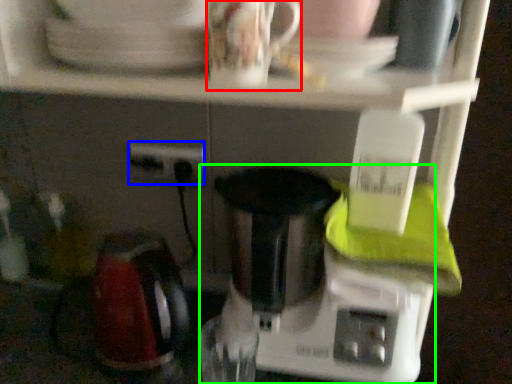
Question: Based on their relative distances, which object is farther from coffee cup (highlighted by a red box)? Choose from power plugs and sockets (highlighted by a blue box) and mixer (highlighted by a green box).

Choices:
 (A) power plugs and sockets
 (B) mixer

Answer: (A)